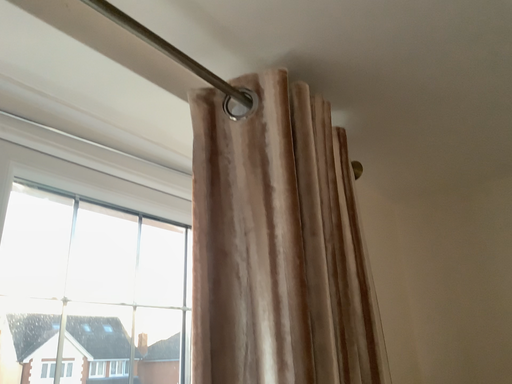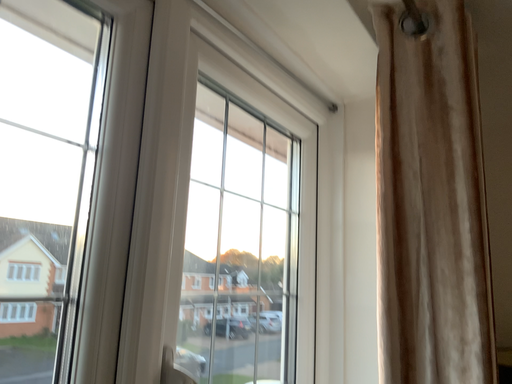
Question: How did the camera likely rotate when shooting the video?

Choices:
 (A) rotated upward
 (B) rotated downward

Answer: (B)